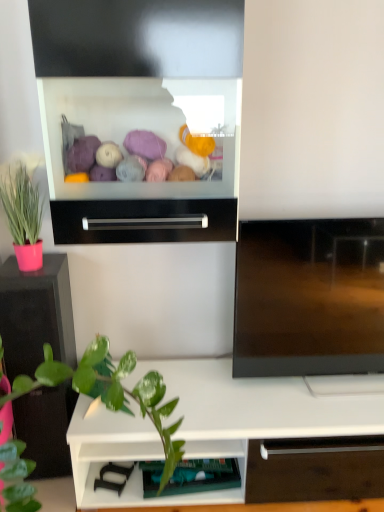
What are the coordinates of `vacant region above black glossy tv cabinet at left (from a real-world perspective)` in the screenshot? It's located at (26, 270).